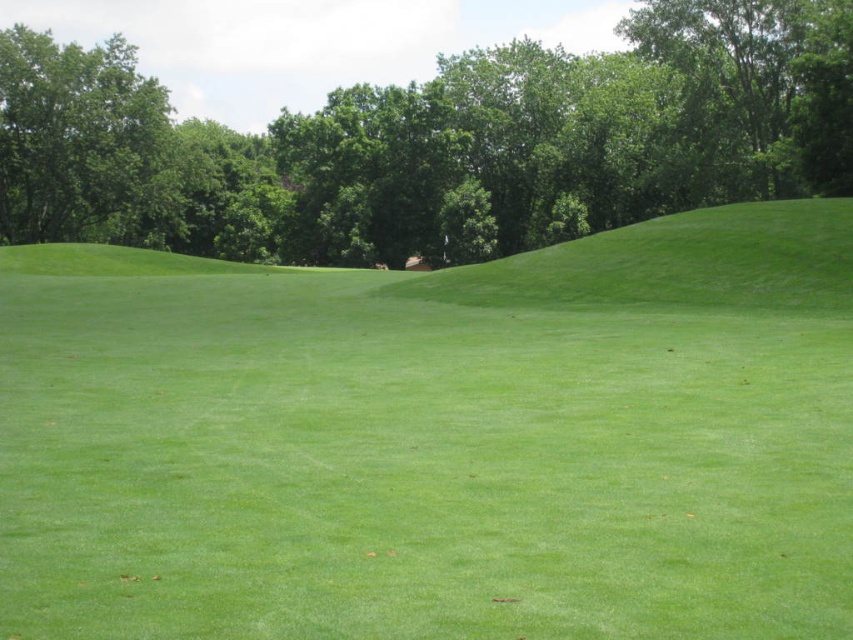
How far apart are green leafy tree at upper center and green grassy hillside at upper right?

green leafy tree at upper center and green grassy hillside at upper right are 38.16 meters apart.

Which is behind, point (827, 140) or point (490, 305)?

The point (827, 140) is more distant.

Which is behind, point (422, 141) or point (618, 292)?

The point (422, 141) is more distant.

The width and height of the screenshot is (853, 640). What are the coordinates of `green leafy tree at upper center` in the screenshot? It's located at (437, 141).

Can you confirm if green grass at center is positioned to the right of green leafy tree at upper center?

Indeed, green grass at center is positioned on the right side of green leafy tree at upper center.

Between green grass at center and green leafy tree at upper center, which one is positioned higher?

Positioned higher is green leafy tree at upper center.

I want to click on green grass at center, so click(x=434, y=440).

Where is `green grass at center`? green grass at center is located at coordinates (434, 440).

Does green grass at center have a greater width compared to green grassy hillside at upper right?

Yes.

Who is positioned more to the left, green grass at center or green grassy hillside at upper right?

green grass at center

Is point (408, 493) in front of point (618, 230)?

Yes, it is in front of point (618, 230).

Where is `green grass at center`? This screenshot has height=640, width=853. green grass at center is located at coordinates (434, 440).